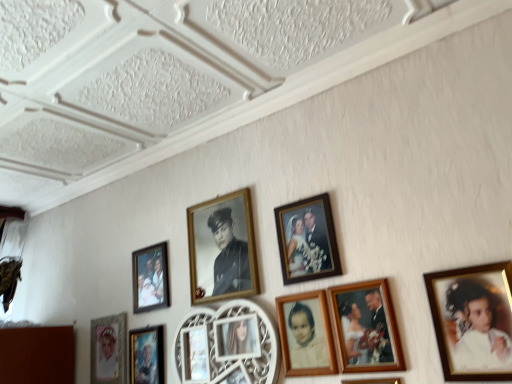
Question: Considering the positions of wooden photo frame at upper center, which is counted as the 6th picture frame, starting from the left, and metallic silver portrait at lower left, the sixth picture frame when ordered from right to left, in the image, is wooden photo frame at upper center, which is counted as the 6th picture frame, starting from the left, bigger or smaller than metallic silver portrait at lower left, the sixth picture frame when ordered from right to left,?

Choices:
 (A) big
 (B) small

Answer: (B)

Question: Relative to metallic silver portrait at lower left, the sixth picture frame when ordered from right to left, is wooden photo frame at upper center, the third picture frame in the right-to-left sequence, in front or behind?

Choices:
 (A) front
 (B) behind

Answer: (A)

Question: Based on their relative distances, which object is nearer to the wooden photo frame at lower center, the first picture frame in the right-to-left sequence?

Choices:
 (A) wooden photo frame at center, which is the 7th picture frame in left-to-right order
 (B) gold-framed photo at center, positioned as the 5th picture frame in right-to-left order
 (C) matte gold picture frame at lower left, marked as the eighth picture frame in a right-to-left arrangement
 (D) wooden photo frame at upper center, which is counted as the 6th picture frame, starting from the left
 (E) matte wooden picture frame at lower left, placed as the seventh picture frame when sorted from right to left

Answer: (A)

Question: Which object is positioned farthest from the wooden photo frame at upper center, which is counted as the 6th picture frame, starting from the left?

Choices:
 (A) matte wooden picture frame at lower left, which appears as the second picture frame when viewed from the left
 (B) metallic silver portrait at lower left, the sixth picture frame when ordered from right to left
 (C) white wood photo frame at center, acting as the fourth picture frame starting from the right
 (D) gold-framed photo at center, positioned as the 5th picture frame in right-to-left order
 (E) matte gold picture frame at lower left, marked as the eighth picture frame in a right-to-left arrangement

Answer: (E)